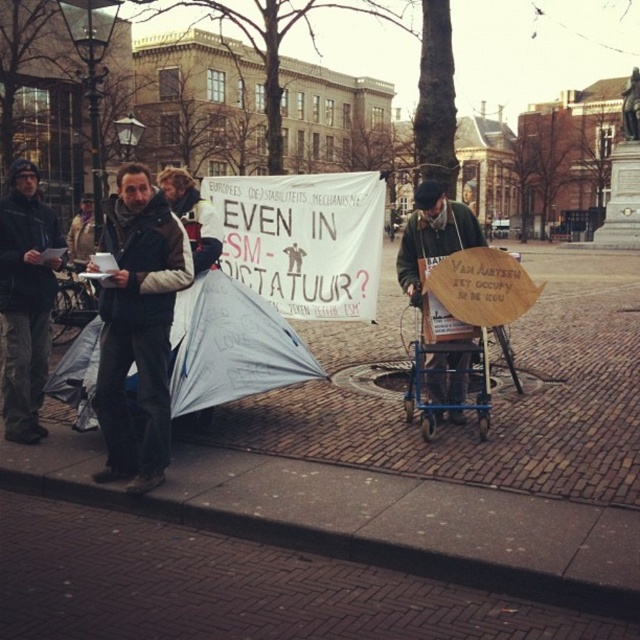
Question: Which point is farther to the camera?

Choices:
 (A) (412, 436)
 (B) (404, 244)
 (C) (468, 364)

Answer: (C)

Question: Can you confirm if gray fabric tent at center is positioned above dark gray jacket at left?

Choices:
 (A) yes
 (B) no

Answer: (B)

Question: Which point is farther to the camera?

Choices:
 (A) (452, 378)
 (B) (252, 300)

Answer: (A)

Question: Does dark gray jacket at left appear under blue metal baby carriage at lower center?

Choices:
 (A) no
 (B) yes

Answer: (A)

Question: Based on their relative distances, which object is nearer to the gray fabric tent at center?

Choices:
 (A) dark brown jacket at center
 (B) brick pavement at center
 (C) wooden signboard at center

Answer: (A)

Question: Can you confirm if gray fabric tent at center is positioned below blue metal baby carriage at lower center?

Choices:
 (A) yes
 (B) no

Answer: (B)